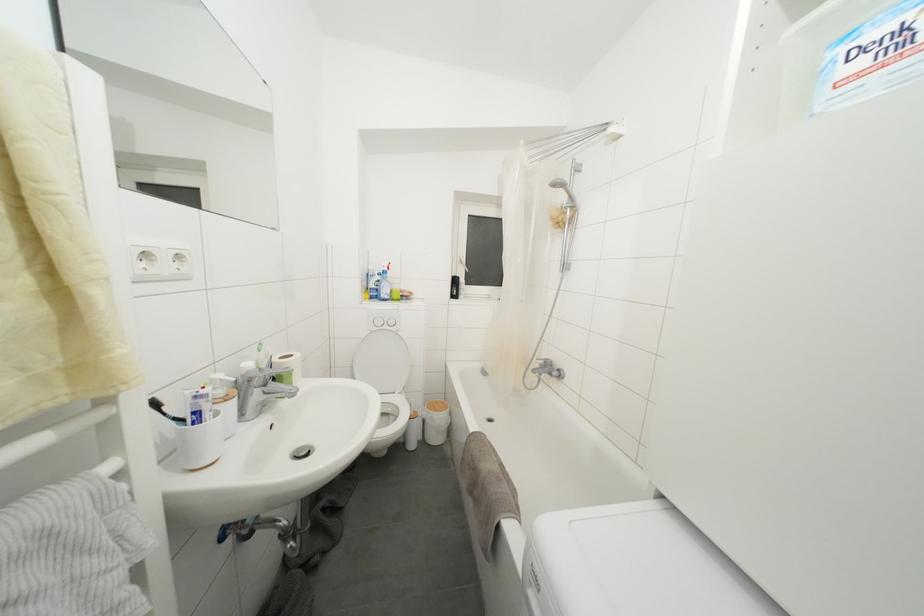
Locate an element on the screen. beige bath sponge is located at coordinates (487, 488).